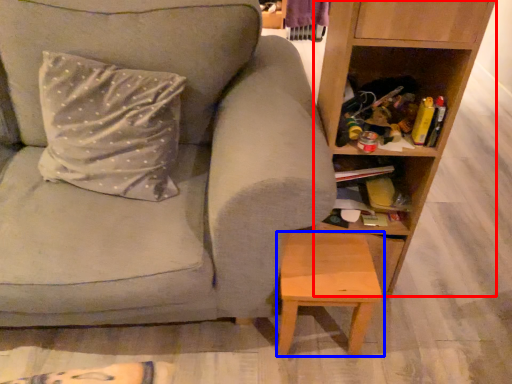
Question: Which of the following is the closest to the observer, shelf (highlighted by a red box) or stool (highlighted by a blue box)?

Choices:
 (A) shelf
 (B) stool

Answer: (A)